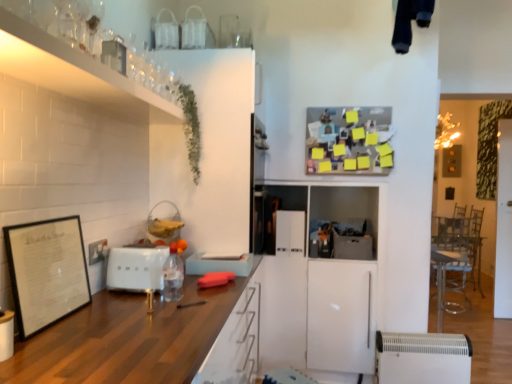
Question: From a real-world perspective, is white glossy refrigerator at center, acting as the 1th appliance starting from the back, physically located above or below green leafy plant at upper left?

Choices:
 (A) above
 (B) below

Answer: (B)

Question: From the image's perspective, is white glossy refrigerator at center, placed as the 4th appliance when sorted from bottom to top, positioned above or below green leafy plant at upper left?

Choices:
 (A) below
 (B) above

Answer: (A)

Question: Which object is positioned farthest from the white matte toaster at center, which appears as the 3th appliance when ordered from the bottom?

Choices:
 (A) clear glass shelf at upper left, acting as the 2th cabinetry starting from the bottom
 (B) black matte picture frame at left
 (C) white plastic heater at lower right, which is the second appliance in front-to-back order
 (D) gray matte cabinet at center, acting as the 3th appliance starting from the left
 (E) wooden countertop at center, which ranks as the first cabinetry in bottom-to-top order

Answer: (C)

Question: Considering the real-world distances, which object is farthest from the white glossy refrigerator at center, placed as the 4th appliance when sorted from bottom to top?

Choices:
 (A) black matte picture frame at left
 (B) wooden countertop at center, acting as the 2th cabinetry starting from the top
 (C) clear plastic bottle at center
 (D) gray matte cabinet at center, which is counted as the third appliance, starting from the top
 (E) white matte toaster at center, the first appliance from the front

Answer: (A)